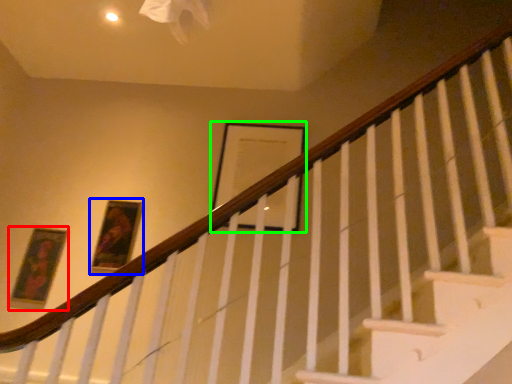
Question: Estimate the real-world distances between objects in this image. Which object is closer to picture frame (highlighted by a red box), picture frame (highlighted by a blue box) or picture frame (highlighted by a green box)?

Choices:
 (A) picture frame
 (B) picture frame

Answer: (A)